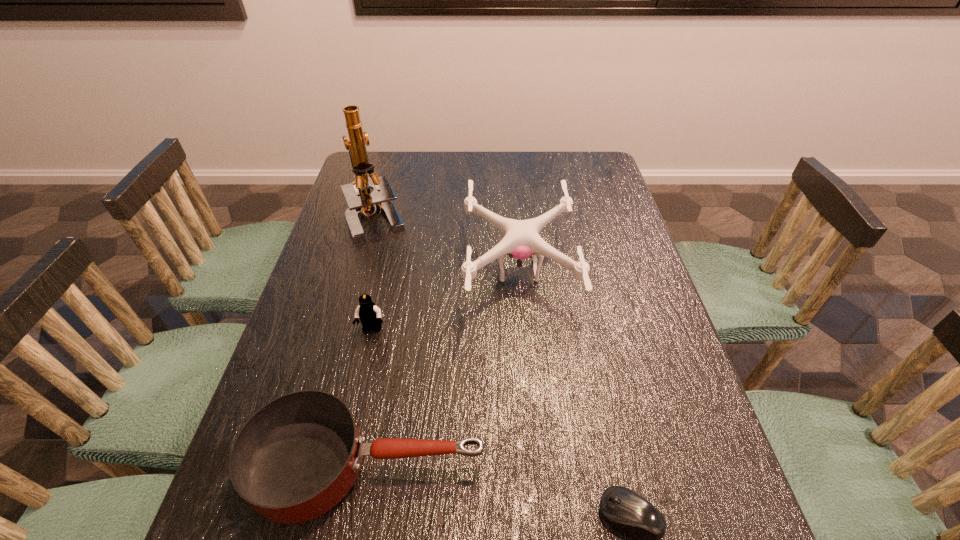
The image size is (960, 540). Identify the location of microscope that is at the left edge. (361, 201).

In order to click on Lego at the left edge in this screenshot , I will do `click(369, 314)`.

Where is `pan that is at the left edge`? The image size is (960, 540). pan that is at the left edge is located at coordinates (297, 457).

Find the location of a particular element. This screenshot has height=540, width=960. vacant space at the far edge of the desktop is located at coordinates (423, 159).

I want to click on vacant space at the left edge of the desktop, so click(x=379, y=240).

Identify the location of free spot at the right edge of the desktop. (713, 478).

At what (x,y) coordinates should I click in order to perform the action: click on vacant position at the far right corner of the desktop. Please return your answer as a coordinate pair (x, y). The width and height of the screenshot is (960, 540). Looking at the image, I should click on (565, 179).

I want to click on vacant area between the second shortest object and the microscope, so click(x=372, y=342).

I want to click on vacant point located between the tallest object and the second tallest object, so click(x=447, y=245).

You are a GUI agent. You are given a task and a screenshot of the screen. Output one action in this format:
    pyautogui.click(x=<x>, y=<y>)
    Task: Click on the unoccupied position between the pan and the third tallest object
    
    Given the screenshot: What is the action you would take?
    pyautogui.click(x=370, y=397)